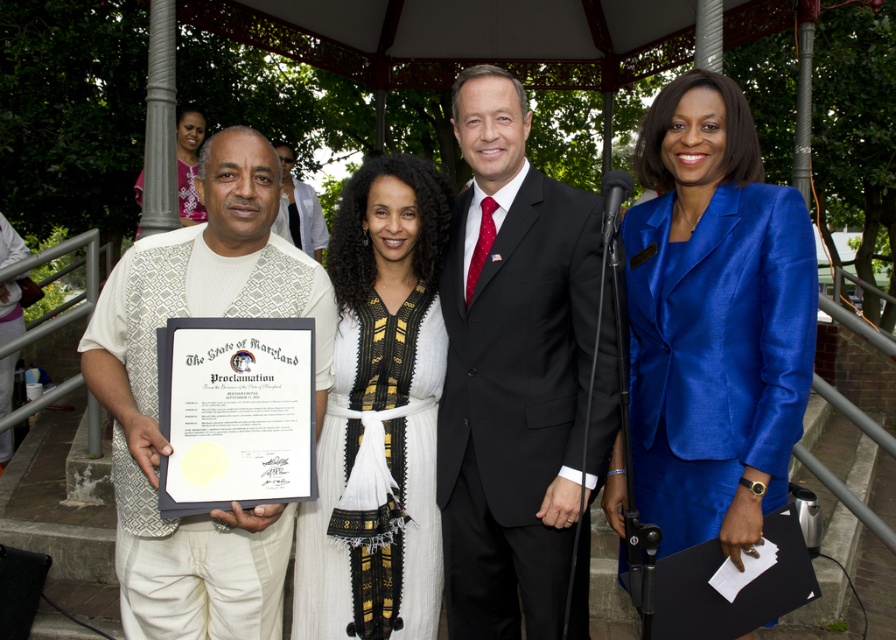
Between point (636, 252) and point (313, 227), which one is positioned behind?

Positioned behind is point (313, 227).

Is point (759, 186) behind point (283, 161)?

No, (759, 186) is in front of (283, 161).

Is point (793, 317) less distant than point (307, 248)?

Yes, it is in front of point (307, 248).

This screenshot has width=896, height=640. In order to click on blue silk suit at center in this screenshot , I will do [713, 320].

Is pink floral dress at upper left above matte white shirt at center?

No.

Looking at this image, is pink floral dress at upper left to the right of matte white shirt at center from the viewer's perspective?

In fact, pink floral dress at upper left is to the left of matte white shirt at center.

Describe the element at coordinates (188, 161) in the screenshot. The image size is (896, 640). I see `pink floral dress at upper left` at that location.

Where is `pink floral dress at upper left`? Image resolution: width=896 pixels, height=640 pixels. pink floral dress at upper left is located at coordinates (188, 161).

Is white woven dress at center above pink floral dress at upper left?

No, white woven dress at center is not above pink floral dress at upper left.

Between white woven dress at center and pink floral dress at upper left, which one is positioned lower?

Positioned lower is white woven dress at center.

This screenshot has height=640, width=896. What are the coordinates of `white woven dress at center` in the screenshot? It's located at (378, 412).